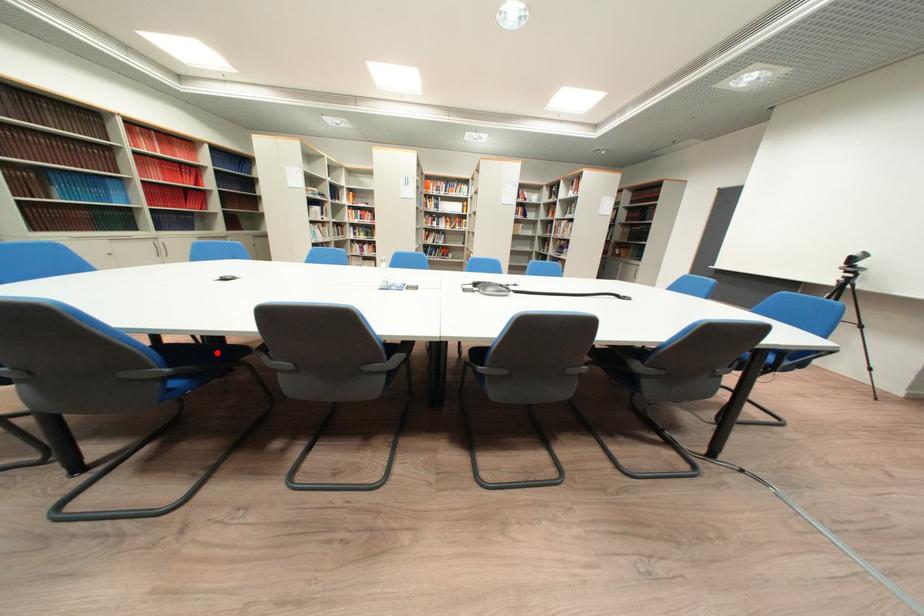
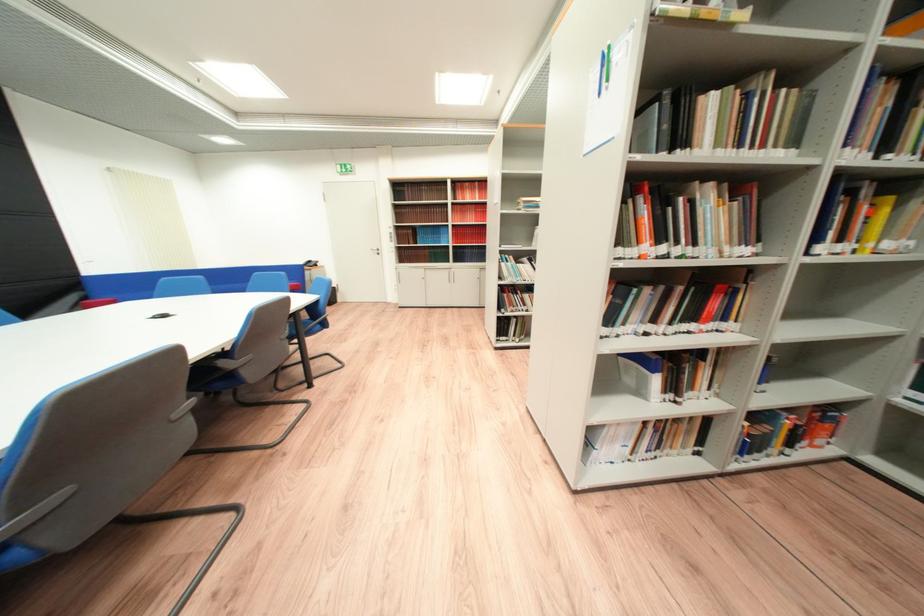
Question: I am providing you with two images of the same scene from different viewpoints. A red point is marked on the first image. Is the red point's position out of view in image 2?

Choices:
 (A) Yes
 (B) No

Answer: (A)